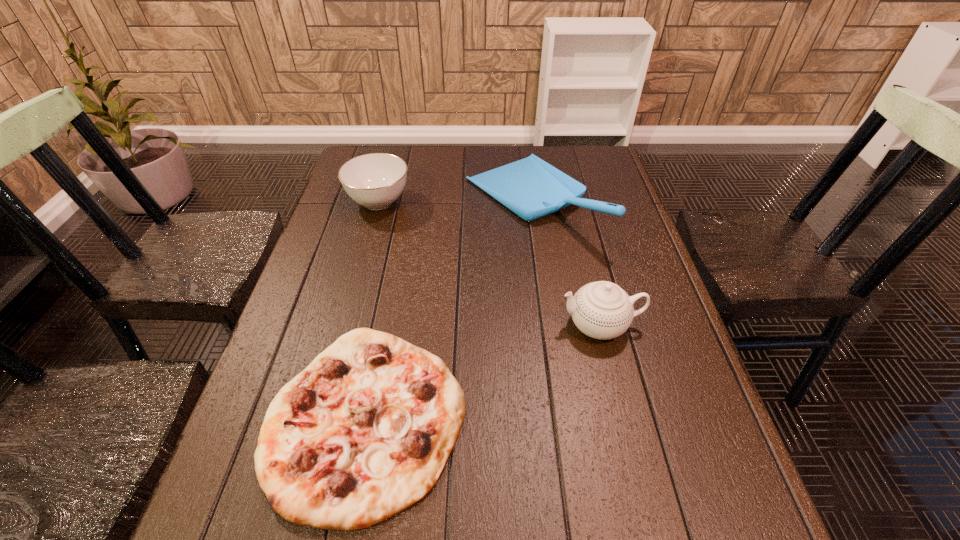
At what (x,y) coordinates should I click in order to perform the action: click on the tallest object. Please return your answer as a coordinate pair (x, y). Looking at the image, I should click on point(532,188).

You are a GUI agent. You are given a task and a screenshot of the screen. Output one action in this format:
    pyautogui.click(x=<x>, y=<y>)
    Task: Click on the right chinaware
    
    Given the screenshot: What is the action you would take?
    [x=602, y=310]

This screenshot has height=540, width=960. What are the coordinates of `the nearer chinaware` in the screenshot? It's located at (602, 310).

At what (x,y) coordinates should I click in order to perform the action: click on the shorter chinaware. Please return your answer as a coordinate pair (x, y). The image size is (960, 540). Looking at the image, I should click on (376, 180).

Find the location of `the farther chinaware`. the farther chinaware is located at coordinates (376, 180).

Locate an element on the screen. The image size is (960, 540). pizza is located at coordinates (364, 432).

Locate an element on the screen. This screenshot has height=540, width=960. blank space located 0.060m on the back of the tallest object is located at coordinates (523, 149).

Image resolution: width=960 pixels, height=540 pixels. Identify the location of vacant area situated on the spout of the right chinaware. (519, 325).

Locate an element on the screen. The width and height of the screenshot is (960, 540). vacant space situated on the spout of the right chinaware is located at coordinates (511, 325).

Locate an element on the screen. This screenshot has height=540, width=960. blank space located 0.280m on the spout of the right chinaware is located at coordinates (436, 325).